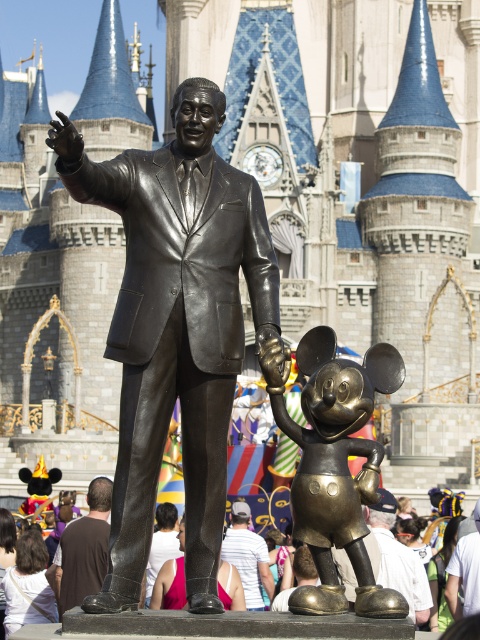
In the scene shown: You are standing in front of the bronze statue of Walt Disney and Mickey Mouse in front of the castle. There is a point marked at coordinates (334,461). What object is located at that point?

The bronze Mickey Mouse statue at center is located at point (334,461).

You are a visitor at the Walt Disney statue and notice the bronze mickey mouse statue at center and the white cotton shirt at lower center. Which object is located to the right of the other?

The bronze mickey mouse statue at center is positioned on the right side of white cotton shirt at lower center.